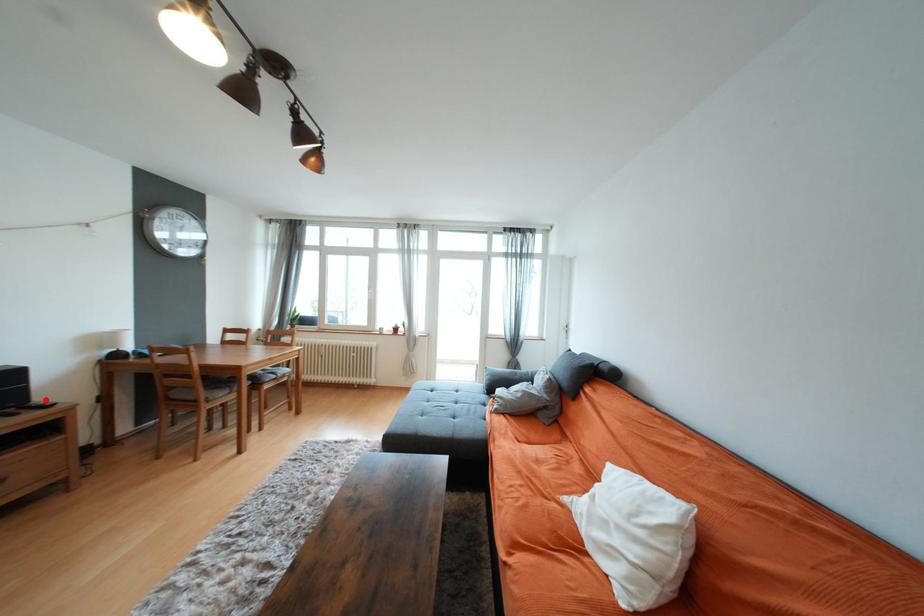
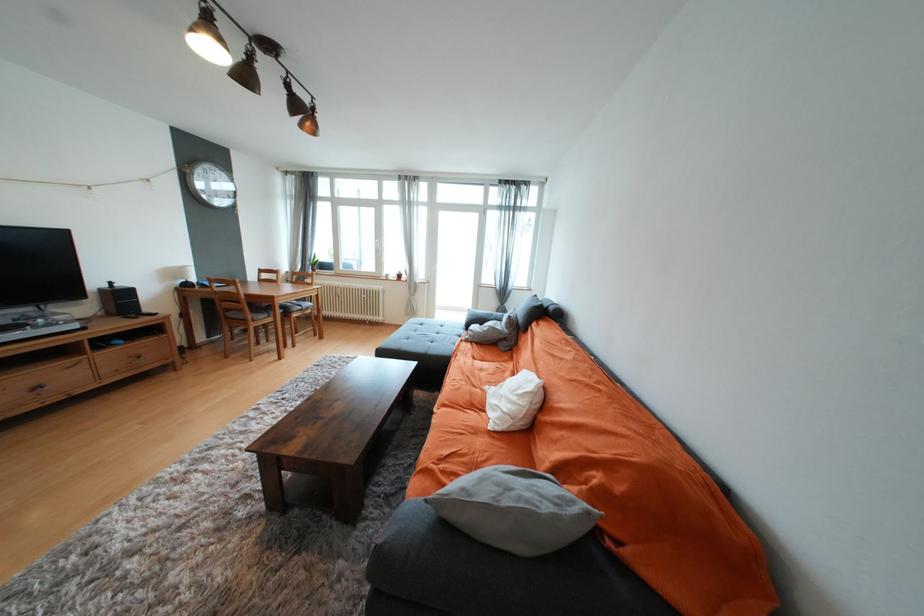
In the second image, find the point that corresponds to the highlighted location in the first image.

(152, 312)